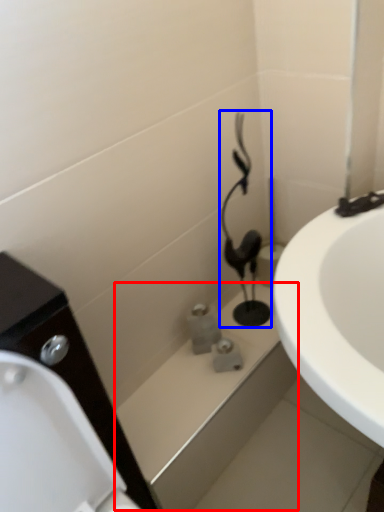
Question: Which object appears farthest to the camera in this image, bath (highlighted by a red box) or plumbing fixture (highlighted by a blue box)?

Choices:
 (A) bath
 (B) plumbing fixture

Answer: (A)